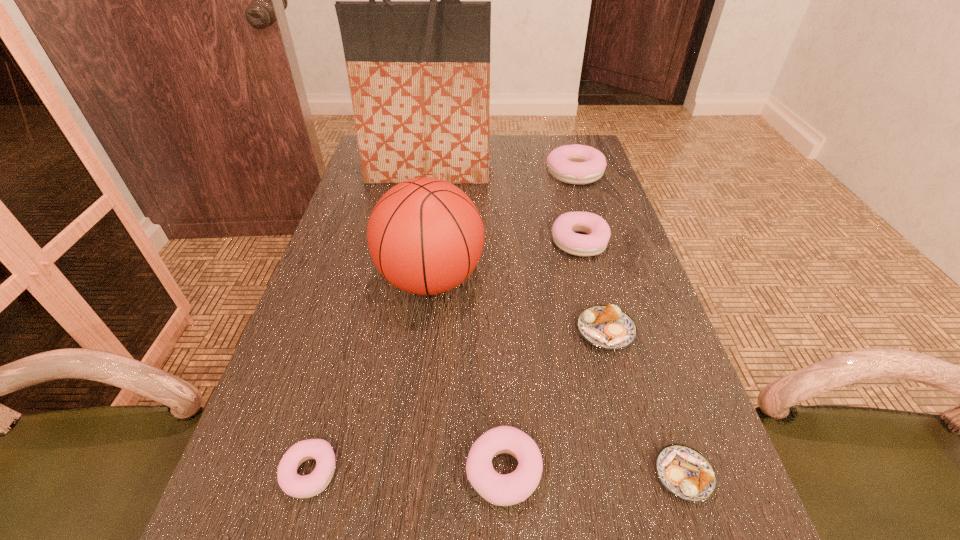
Find the location of a particular element. Image resolution: width=960 pixels, height=540 pixels. blank space located on the back of the nearer brown pastry is located at coordinates (637, 338).

Locate an element on the screen. The width and height of the screenshot is (960, 540). shopping bag present at the far edge is located at coordinates (419, 71).

In order to click on pastry located in the far edge section of the desktop in this screenshot , I will do `click(577, 164)`.

The image size is (960, 540). I want to click on shopping bag that is at the left edge, so click(419, 71).

Locate an element on the screen. basketball at the left edge is located at coordinates (425, 235).

Image resolution: width=960 pixels, height=540 pixels. In order to click on pastry present at the left edge in this screenshot , I will do `click(297, 486)`.

This screenshot has width=960, height=540. In order to click on object that is at the far left corner in this screenshot , I will do `click(419, 71)`.

Where is `object positioned at the far right corner`? object positioned at the far right corner is located at coordinates (577, 164).

The image size is (960, 540). Identify the location of vacant region at the far edge of the desktop. (540, 154).

I want to click on vacant area at the left edge of the desktop, so click(x=303, y=323).